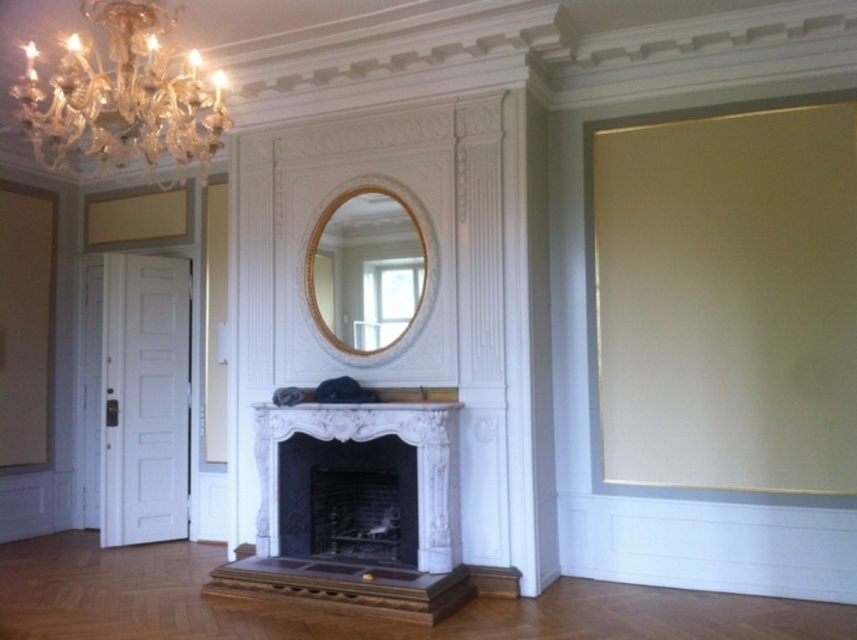
From the picture: Which is more to the left, white marble fireplace at center or gold textured mirror at center?

white marble fireplace at center

Can you confirm if white marble fireplace at center is smaller than gold textured mirror at center?

No.

Find the location of `white marble fireplace at center`. white marble fireplace at center is located at coordinates (358, 468).

I want to click on white marble fireplace at center, so click(x=358, y=468).

Is dark gray stone fireplace at center to the left of gold textured mirror at center from the viewer's perspective?

Yes, dark gray stone fireplace at center is to the left of gold textured mirror at center.

Is dark gray stone fireplace at center closer to camera compared to gold textured mirror at center?

Yes, it is.

Find the location of a particular element. The width and height of the screenshot is (857, 640). dark gray stone fireplace at center is located at coordinates (346, 497).

Does crystal glass chandelier at upper left appear under gold textured mirror at center?

No.

Does point (81, 148) come closer to viewer compared to point (423, 241)?

That is False.

Identify the location of crystal glass chandelier at upper left. (123, 97).